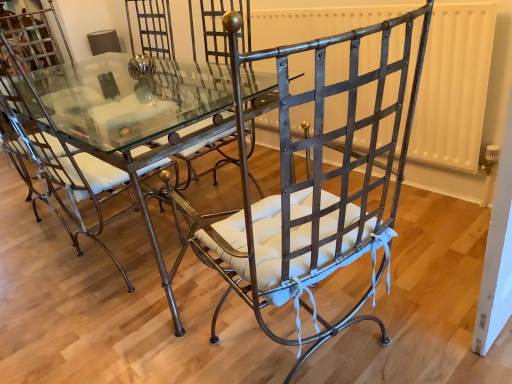
Question: Is clear glass table at center to the left or to the right of wrought iron chair at center, which is the 1th chair from left to right, in the image?

Choices:
 (A) right
 (B) left

Answer: (A)

Question: Considering the positions of clear glass table at center and wrought iron chair at center, which ranks as the 2th chair in right-to-left order, in the image, is clear glass table at center bigger or smaller than wrought iron chair at center, which ranks as the 2th chair in right-to-left order,?

Choices:
 (A) small
 (B) big

Answer: (B)

Question: Which object is positioned farthest from the metallic wrought iron chair at center, which is the second chair in left-to-right order?

Choices:
 (A) wrought iron chair at center, which is the 1th chair from left to right
 (B) clear glass table at center

Answer: (B)

Question: Which object is the closest to the clear glass table at center?

Choices:
 (A) metallic wrought iron chair at center, which is the second chair in left-to-right order
 (B) wrought iron chair at center, which ranks as the 2th chair in right-to-left order

Answer: (B)